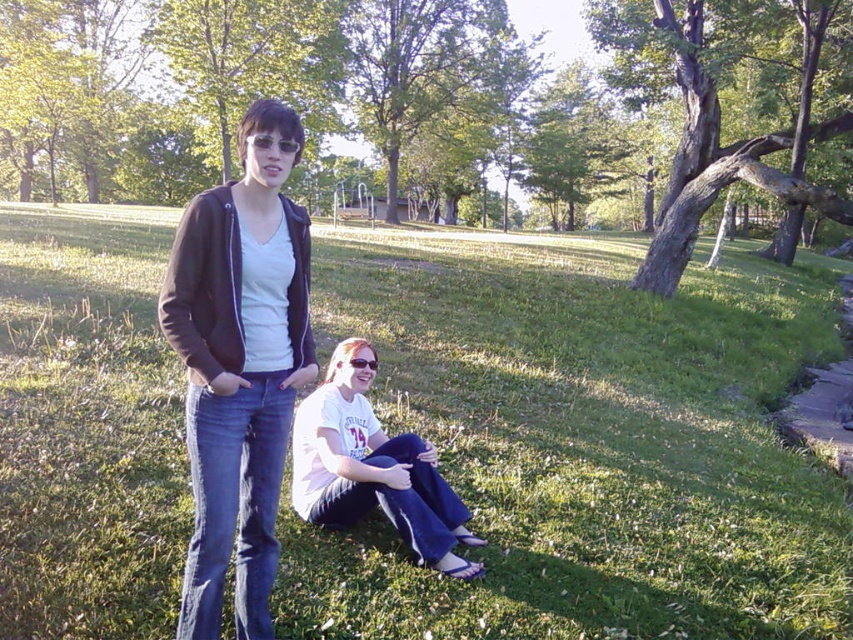
You are a drone operator trying to capture a photo of the two people in the park. The drone is currently hovering at point coordinates of 0.7, 0.7. The green grass at center is at point 0.694, 0.683. Which direction should you move the drone to get a better shot of the people?

The green grass at center is located at coordinates (582, 444). Since the drone is at (596, 448), it is slightly northeast of the grass. To get a better shot of the people, move the drone southwest towards the grass to align with the subjects.